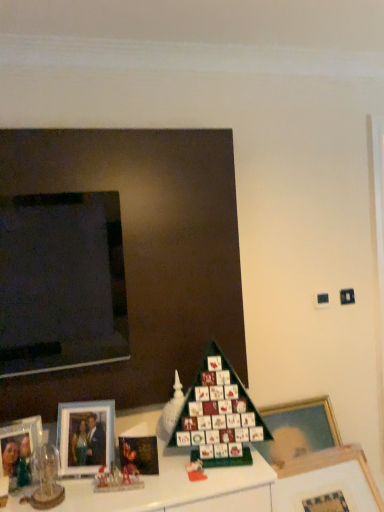
Locate an element on the screen. The image size is (384, 512). free space to the left of matte plastic toy at lower center is located at coordinates (161, 477).